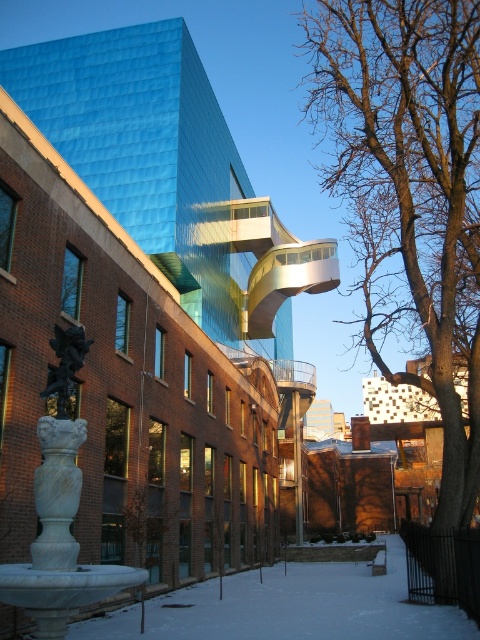
Between white marble statue at center and black marble statue at lower left, which one has more height?

Standing taller between the two is white marble statue at center.

Find the location of a particular element. The image size is (480, 640). white marble statue at center is located at coordinates (59, 460).

Which is more to the right, bare branches at center or white marble statue at center?

bare branches at center is more to the right.

Can you confirm if bare branches at center is smaller than white marble statue at center?

Incorrect, bare branches at center is not smaller in size than white marble statue at center.

Where is `bare branches at center`? Image resolution: width=480 pixels, height=640 pixels. bare branches at center is located at coordinates (409, 192).

Is point (435, 106) closer to viewer compared to point (58, 404)?

No.

Which of these two, bare branches at center or black marble statue at lower left, stands taller?

bare branches at center

Between point (444, 38) and point (49, 376), which one is positioned behind?

Point (444, 38)

The image size is (480, 640). I want to click on bare branches at center, so click(x=409, y=192).